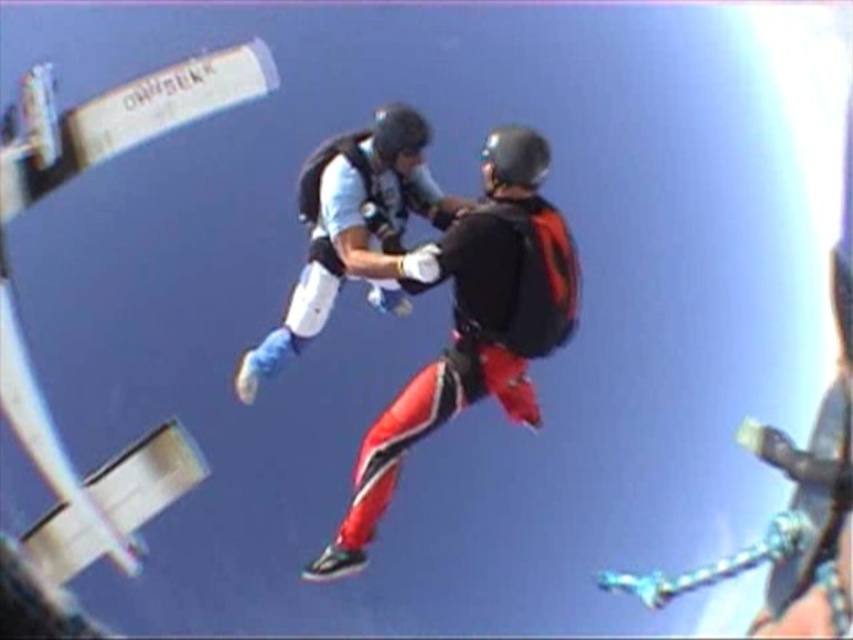
You are a photographer capturing the skydivers from the ground. You need to ensure both the red and black ski suit at center and the matte white suit at center are clearly visible in your shot. Given their sizes, which suit might require you to adjust your camera focus more carefully to avoid blurriness?

The red and black ski suit at center is wider than the matte white suit at center, so it might require more careful focus adjustment to ensure clarity due to its larger size.

You are a skydiving instructor planning to land both skydivers safely. The minimum safe distance between two skydivers during landing is 1.5 meters. Based on the image, can the red and black ski suit at center and the matte white suit at center maintain the required distance during landing?

The red and black ski suit at center is 1.36 meters away from the matte white suit at center. Since 1.36 meters is less than the required 1.5 meters, they cannot maintain the safe distance during landing.